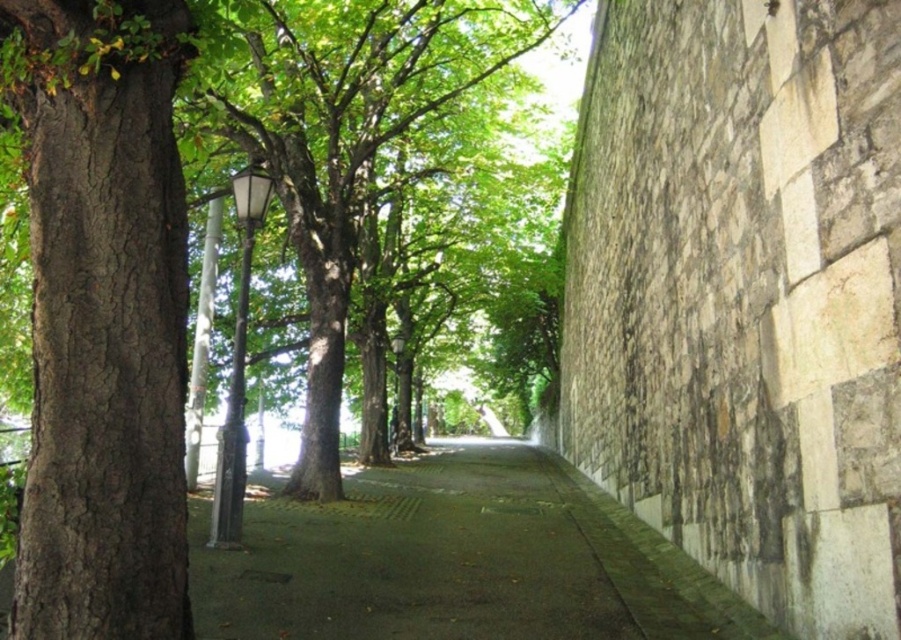
Question: Among these objects, which one is nearest to the camera?

Choices:
 (A) brown rough bark tree at left
 (B) green concrete pavement at center

Answer: (A)

Question: Is brown rough bark tree at left bigger than green leafy tree at center?

Choices:
 (A) no
 (B) yes

Answer: (B)

Question: Can you confirm if brown rough bark tree at left is positioned below green concrete pavement at center?

Choices:
 (A) yes
 (B) no

Answer: (B)

Question: Which of the following is the closest to the observer?

Choices:
 (A) (381, 22)
 (B) (537, 515)

Answer: (B)

Question: Considering the real-world distances, which object is closest to the green concrete pavement at center?

Choices:
 (A) green leafy tree at center
 (B) brown rough bark tree at left

Answer: (B)

Question: Is brown rough bark tree at left positioned before green leafy tree at center?

Choices:
 (A) yes
 (B) no

Answer: (A)